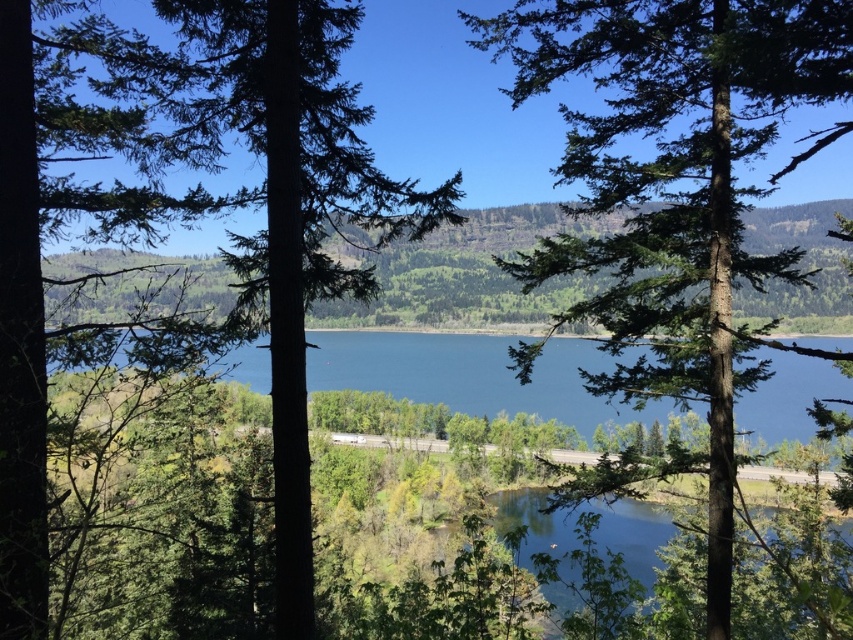
Is point (300, 202) positioned in front of point (641, 556)?

Yes, it is.

I want to click on green matte tree at center, so click(x=241, y=188).

What do you see at coordinates (241, 188) in the screenshot? Image resolution: width=853 pixels, height=640 pixels. I see `green matte tree at center` at bounding box center [241, 188].

The width and height of the screenshot is (853, 640). In order to click on green matte tree at center in this screenshot , I will do `click(241, 188)`.

Is green matte tree at center positioned at the back of blue glassy water at center?

No, it is not.

Is green matte tree at center to the left of blue glassy water at center from the viewer's perspective?

Yes, green matte tree at center is to the left of blue glassy water at center.

Does point (223, 92) come farther from viewer compared to point (814, 394)?

No, it is not.

Locate an element on the screen. The image size is (853, 640). green matte tree at center is located at coordinates (241, 188).

How far apart are green textured tree at center and clear blue water at center?

They are 21.18 meters apart.

Can you confirm if green textured tree at center is thinner than clear blue water at center?

No.

Is point (685, 276) behind point (498, 493)?

That is False.

This screenshot has height=640, width=853. What are the coordinates of `green textured tree at center` in the screenshot? It's located at (676, 189).